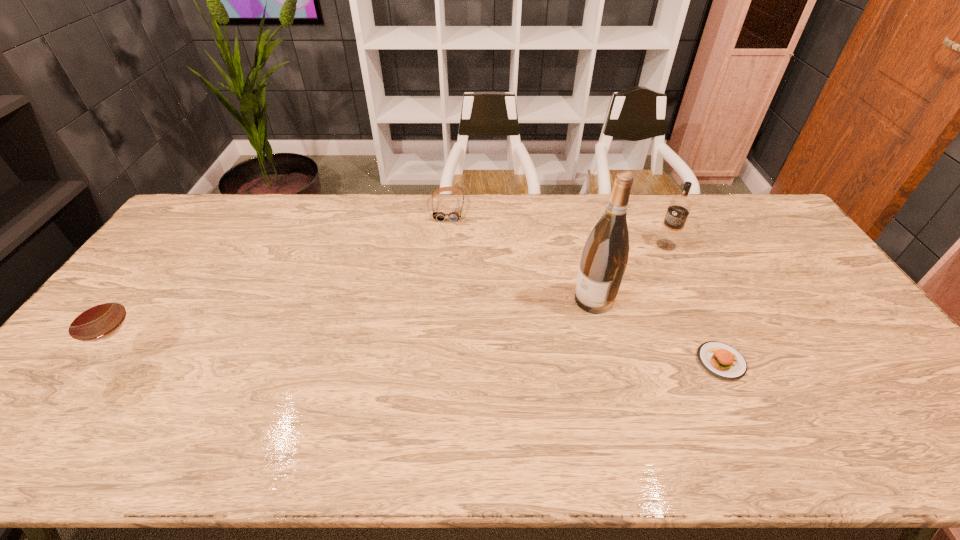
The width and height of the screenshot is (960, 540). In order to click on free spot on the desktop that is between the third tallest object and the shortest object and is positioned on the label of the third object from right to left in this screenshot , I will do `click(486, 361)`.

You are a GUI agent. You are given a task and a screenshot of the screen. Output one action in this format:
    pyautogui.click(x=<x>, y=<y>)
    Task: Click on the free space on the desktop that is between the leftmost object and the food and is positioned on the front-facing side of the fourth tallest object
    
    Given the screenshot: What is the action you would take?
    (x=438, y=362)

This screenshot has width=960, height=540. What are the coordinates of `free space on the desktop that is between the wineglass and the shortest object and is positioned on the label of the vodka` in the screenshot? It's located at (492, 361).